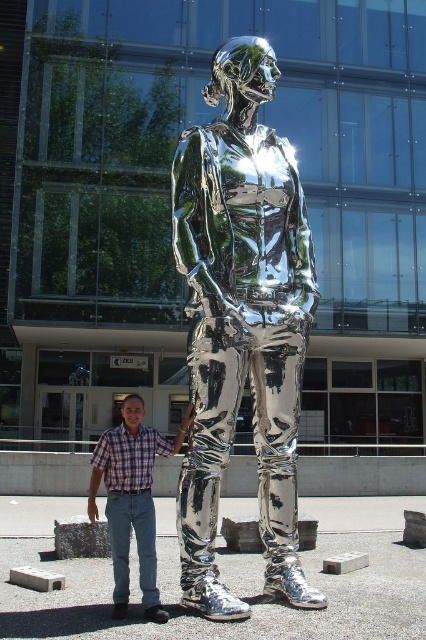
Question: Can you confirm if shiny metallic figure at center is positioned below plaid shirt at center?

Choices:
 (A) no
 (B) yes

Answer: (A)

Question: Does shiny metallic figure at center appear on the right side of plaid shirt at center?

Choices:
 (A) no
 (B) yes

Answer: (B)

Question: Which point is farther from the camera taking this photo?

Choices:
 (A) (210, 484)
 (B) (152, 579)

Answer: (B)

Question: Which object is farther from the camera taking this photo?

Choices:
 (A) plaid shirt at center
 (B) shiny metallic figure at center

Answer: (A)

Question: Is shiny metallic figure at center positioned in front of plaid shirt at center?

Choices:
 (A) yes
 (B) no

Answer: (A)